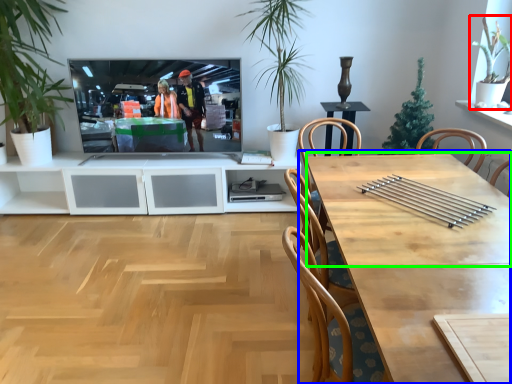
Question: Which object is positioned closest to houseplant (highlighted by a red box)? Select from table (highlighted by a blue box) and counter top (highlighted by a green box).

Choices:
 (A) table
 (B) counter top

Answer: (B)